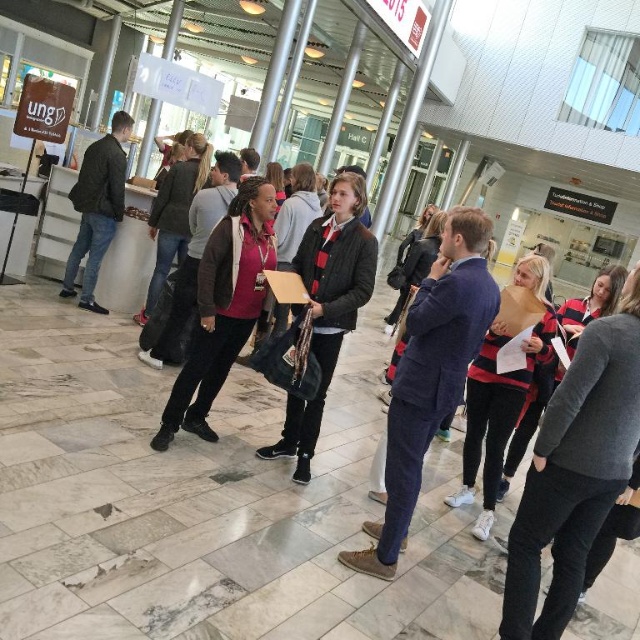
Question: Where is matte black jacket at center located in relation to dark gray jacket at left in the image?

Choices:
 (A) right
 (B) left

Answer: (A)

Question: Which point appears closest to the camera in this image?

Choices:
 (A) (100, 195)
 (B) (262, 451)

Answer: (B)

Question: Which of the following is the closest to the observer?

Choices:
 (A) dark gray jacket at left
 (B) matte black jacket at center

Answer: (B)

Question: Can you confirm if matte black jacket at center is bigger than dark gray jacket at left?

Choices:
 (A) yes
 (B) no

Answer: (B)

Question: Among these objects, which one is farthest from the camera?

Choices:
 (A) dark gray jacket at left
 (B) matte black jacket at center

Answer: (A)

Question: Is matte black jacket at center positioned before dark gray jacket at left?

Choices:
 (A) yes
 (B) no

Answer: (A)